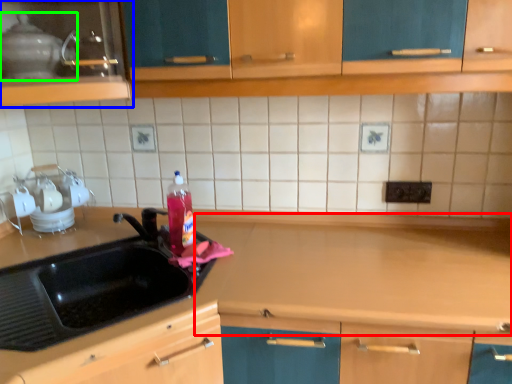
Question: Considering the real-world distances, which object is farthest from counter top (highlighted by a red box)? cabinetry (highlighted by a blue box) or appliance (highlighted by a green box)?

Choices:
 (A) cabinetry
 (B) appliance

Answer: (B)